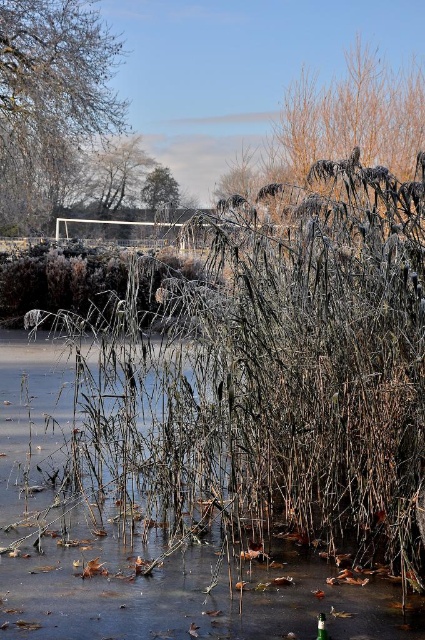
Question: Estimate the real-world distances between objects in this image. Which object is farther from the smooth white tree at upper left?

Choices:
 (A) green leafy tree at upper center
 (B) brown matte bush at center
 (C) brown textured tree at upper center

Answer: (B)

Question: Is brown matte bush at center to the left of brown textured tree at upper center from the viewer's perspective?

Choices:
 (A) no
 (B) yes

Answer: (A)

Question: Is the position of brown matte bush at center more distant than that of green leafy tree at upper center?

Choices:
 (A) no
 (B) yes

Answer: (A)

Question: Which object is closer to the camera taking this photo?

Choices:
 (A) brown matte bush at center
 (B) smooth white tree at upper left

Answer: (A)

Question: Among these objects, which one is nearest to the camera?

Choices:
 (A) brown matte bush at center
 (B) brown textured tree at upper center
 (C) green leafy tree at upper center
 (D) smooth white tree at upper left

Answer: (A)

Question: Does brown matte bush at center have a lesser width compared to brown textured tree at upper center?

Choices:
 (A) yes
 (B) no

Answer: (B)